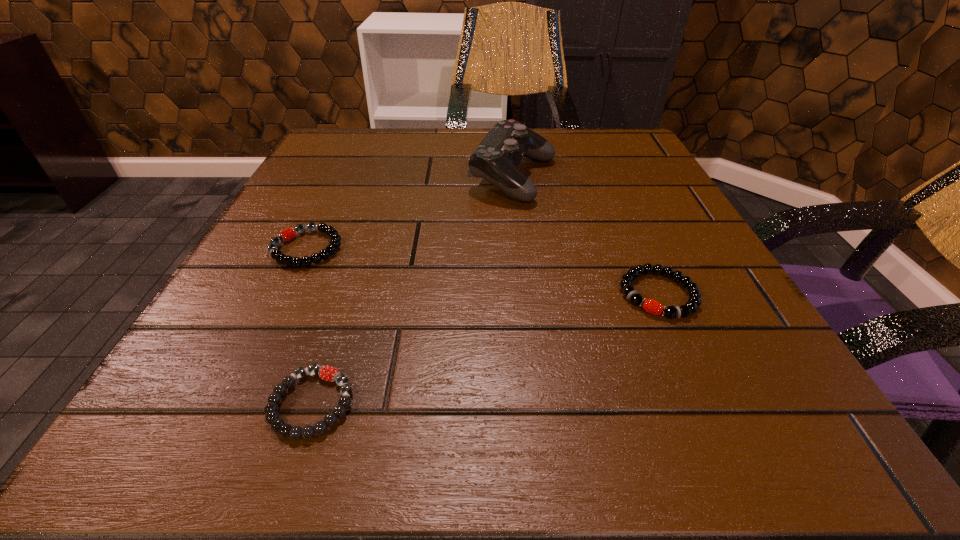
Where is `object located in the right edge section of the desktop`? Image resolution: width=960 pixels, height=540 pixels. object located in the right edge section of the desktop is located at coordinates (651, 306).

This screenshot has height=540, width=960. In order to click on object positioned at the near left corner in this screenshot , I will do `click(328, 373)`.

Locate an element on the screen. free spot at the far edge of the desktop is located at coordinates (559, 147).

In the image, there is a desktop. Find the location of `free space at the near edge`. free space at the near edge is located at coordinates (364, 450).

Identify the location of vacant space at the left edge of the desktop. (330, 184).

The width and height of the screenshot is (960, 540). I want to click on vacant space at the right edge, so click(x=709, y=316).

At what (x,y) coordinates should I click in order to perform the action: click on vacant space at the near left corner of the desktop. Please return your answer as a coordinate pair (x, y). Image resolution: width=960 pixels, height=540 pixels. Looking at the image, I should click on (155, 403).

This screenshot has height=540, width=960. I want to click on free space at the far right corner, so click(x=594, y=172).

Image resolution: width=960 pixels, height=540 pixels. Identify the location of vacant point located between the third object from left to right and the rightmost bracelet. (586, 237).

Locate an element on the screen. free point between the control and the rightmost object is located at coordinates (586, 237).